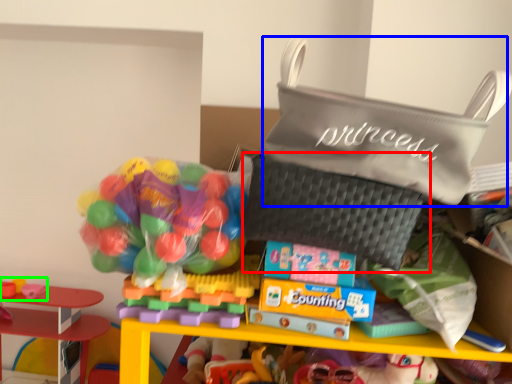
Question: Based on their relative distances, which object is nearer to pouch (highlighted by a red box)? Choose from pouch (highlighted by a blue box) and toy (highlighted by a green box).

Choices:
 (A) pouch
 (B) toy

Answer: (A)